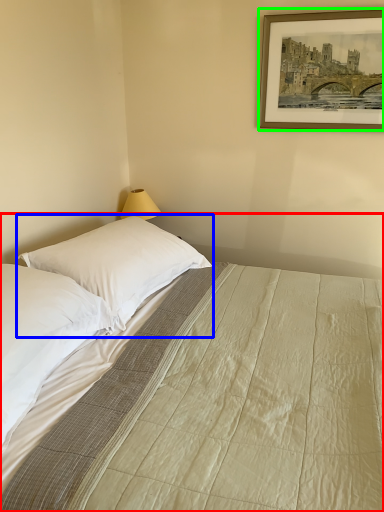
Question: Based on their relative distances, which object is nearer to bed (highlighted by a red box)? Choose from pillow (highlighted by a blue box) and picture frame (highlighted by a green box).

Choices:
 (A) pillow
 (B) picture frame

Answer: (A)